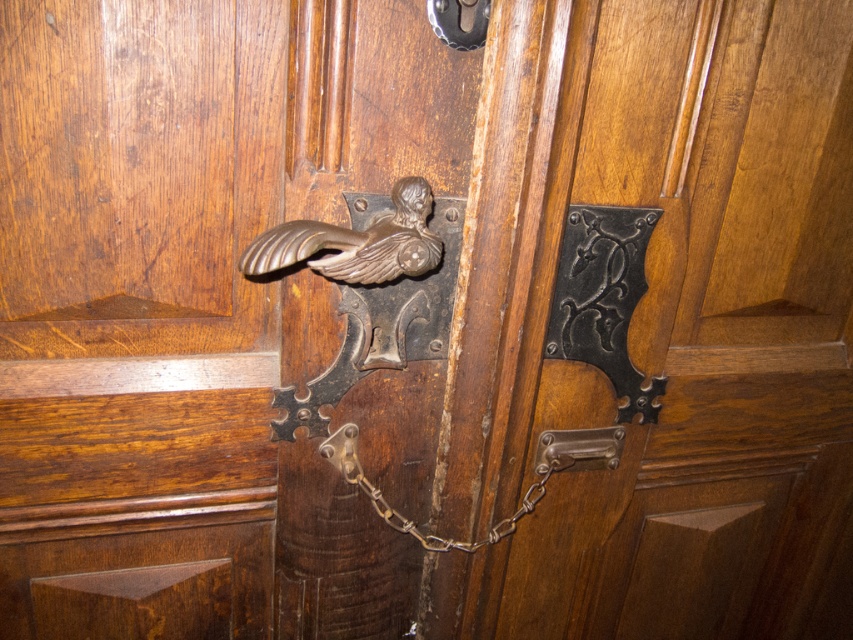
Between metallic silver door handle at center and rusty metal chain at center, which one has less height?

With less height is metallic silver door handle at center.

Does point (577, 465) lie in front of point (543, 481)?

No, (577, 465) is further to viewer.

Does point (558, 454) come farther from viewer compared to point (355, 467)?

Yes, point (558, 454) is farther from viewer.

Where is `metallic silver door handle at center`? metallic silver door handle at center is located at coordinates (578, 449).

Does polished brass handle at center have a smaller size compared to rusty metal chain at center?

No.

Which of these two, polished brass handle at center or rusty metal chain at center, stands taller?

Standing taller between the two is polished brass handle at center.

What do you see at coordinates (196, 307) in the screenshot? I see `polished brass handle at center` at bounding box center [196, 307].

Find the location of a particular element. The image size is (853, 640). polished brass handle at center is located at coordinates (196, 307).

Who is higher up, polished dark wood door handle at center or bronze polished bird at center?

bronze polished bird at center is higher up.

Is polished dark wood door handle at center smaller than bronze polished bird at center?

Incorrect, polished dark wood door handle at center is not smaller in size than bronze polished bird at center.

Where is `polished dark wood door handle at center`? polished dark wood door handle at center is located at coordinates (717, 333).